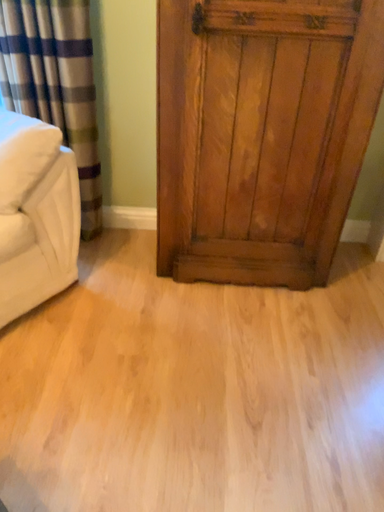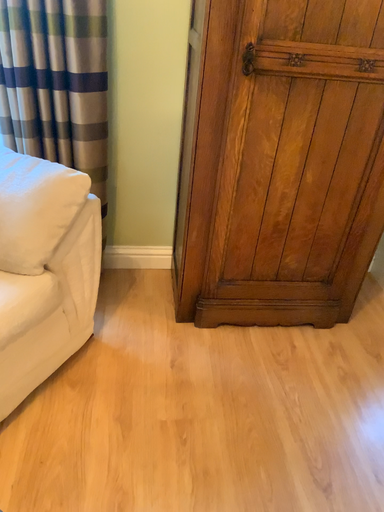
Question: How did the camera likely rotate when shooting the video?

Choices:
 (A) rotated right
 (B) rotated left

Answer: (A)